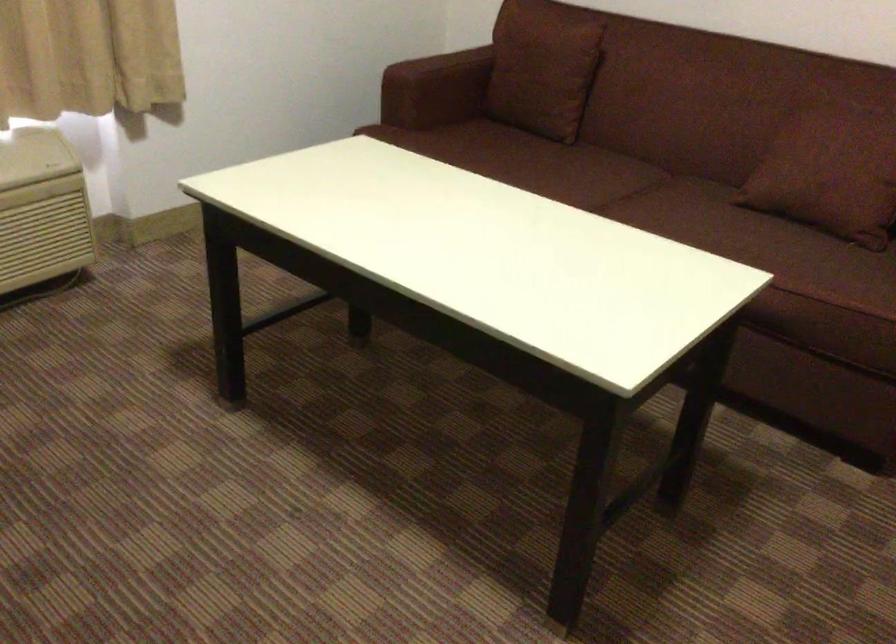
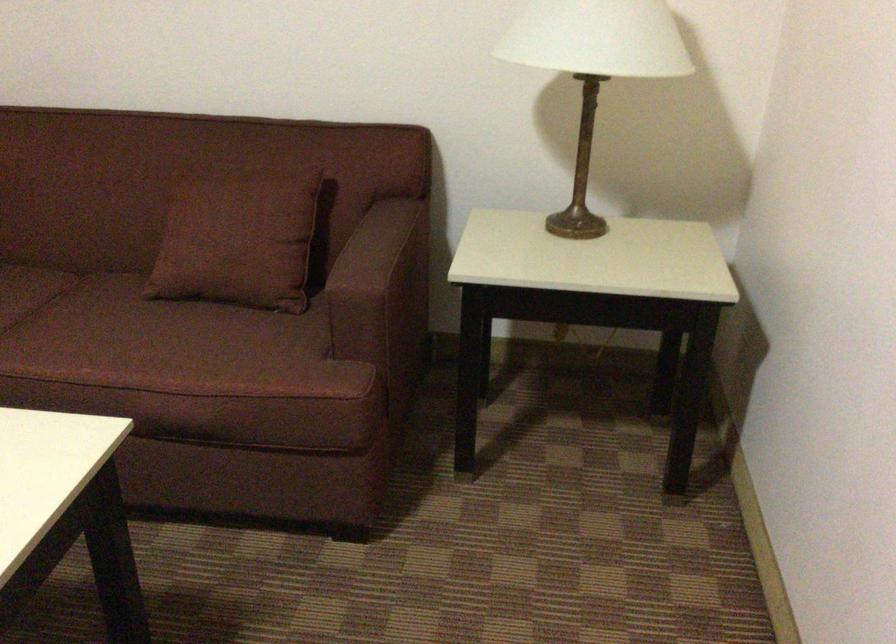
Find the pixel in the second image that matches [725,228] in the first image.

(135, 339)